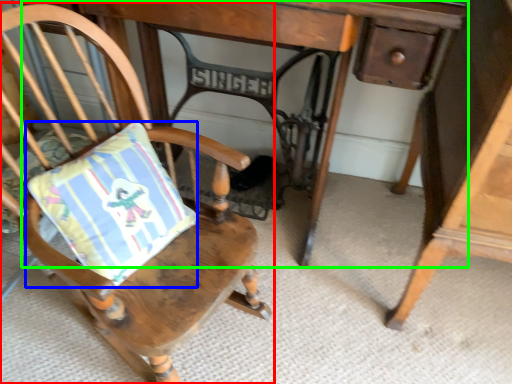
Question: Which is nearer to the chair (highlighted by a red box)? pillow (highlighted by a blue box) or table (highlighted by a green box).

Choices:
 (A) pillow
 (B) table

Answer: (A)